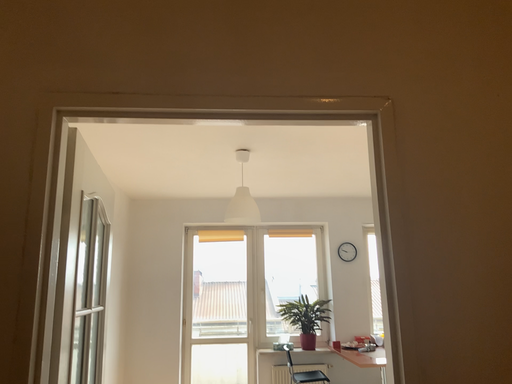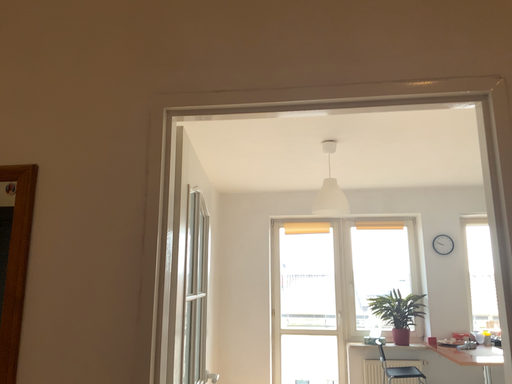
Question: How did the camera likely rotate when shooting the video?

Choices:
 (A) rotated right
 (B) rotated left

Answer: (B)